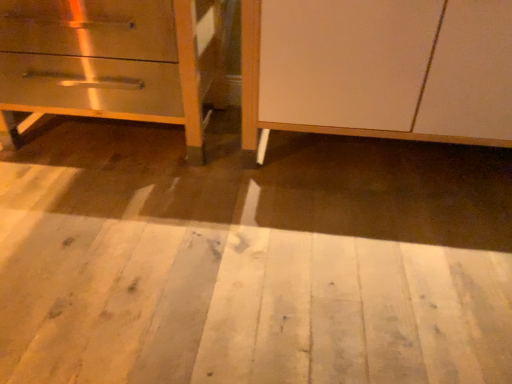
Question: Considering the relative positions of metallic silver drawer at left and white matte cabinet at center in the image provided, is metallic silver drawer at left to the right of white matte cabinet at center from the viewer's perspective?

Choices:
 (A) no
 (B) yes

Answer: (A)

Question: Considering the relative sizes of metallic silver drawer at left and white matte cabinet at center in the image provided, is metallic silver drawer at left thinner than white matte cabinet at center?

Choices:
 (A) no
 (B) yes

Answer: (B)

Question: Is metallic silver drawer at left with white matte cabinet at center?

Choices:
 (A) no
 (B) yes

Answer: (A)

Question: From a real-world perspective, does metallic silver drawer at left sit lower than white matte cabinet at center?

Choices:
 (A) yes
 (B) no

Answer: (A)

Question: From a real-world perspective, is metallic silver drawer at left physically above white matte cabinet at center?

Choices:
 (A) yes
 (B) no

Answer: (B)

Question: Is point (390, 263) positioned closer to the camera than point (8, 115)?

Choices:
 (A) farther
 (B) closer

Answer: (B)

Question: Considering the positions of white wood floor at lower center and metallic silver drawer at left in the image, is white wood floor at lower center bigger or smaller than metallic silver drawer at left?

Choices:
 (A) small
 (B) big

Answer: (A)

Question: From a real-world perspective, is white wood floor at lower center physically located above or below metallic silver drawer at left?

Choices:
 (A) below
 (B) above

Answer: (A)

Question: Considering their positions, is white wood floor at lower center located in front of or behind metallic silver drawer at left?

Choices:
 (A) behind
 (B) front

Answer: (B)

Question: From the image's perspective, is white matte cabinet at center positioned above or below metallic silver drawer at left?

Choices:
 (A) above
 (B) below

Answer: (B)

Question: Considering their positions, is white matte cabinet at center located in front of or behind metallic silver drawer at left?

Choices:
 (A) behind
 (B) front

Answer: (B)

Question: From their relative heights in the image, would you say white matte cabinet at center is taller or shorter than metallic silver drawer at left?

Choices:
 (A) tall
 (B) short

Answer: (A)

Question: From a real-world perspective, is white matte cabinet at center positioned above or below metallic silver drawer at left?

Choices:
 (A) below
 (B) above

Answer: (B)

Question: Considering the positions of white matte cabinet at center and white wood floor at lower center in the image, is white matte cabinet at center taller or shorter than white wood floor at lower center?

Choices:
 (A) tall
 (B) short

Answer: (A)

Question: Looking at the image, does white matte cabinet at center seem bigger or smaller compared to white wood floor at lower center?

Choices:
 (A) big
 (B) small

Answer: (A)